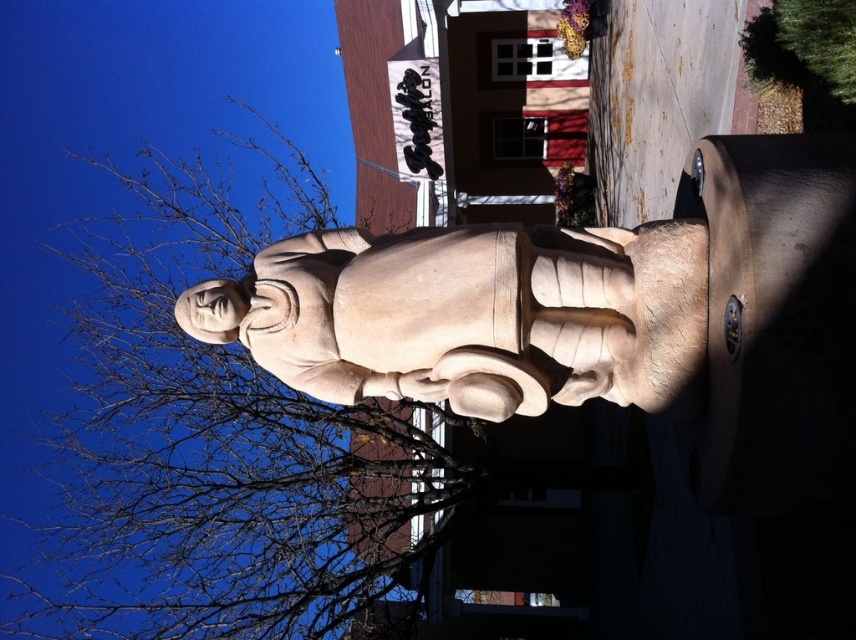
Between bare branches at upper left and smooth beige statue at center, which one appears on the left side from the viewer's perspective?

bare branches at upper left is more to the left.

What do you see at coordinates (220, 442) in the screenshot? Image resolution: width=856 pixels, height=640 pixels. I see `bare branches at upper left` at bounding box center [220, 442].

The image size is (856, 640). I want to click on bare branches at upper left, so click(x=220, y=442).